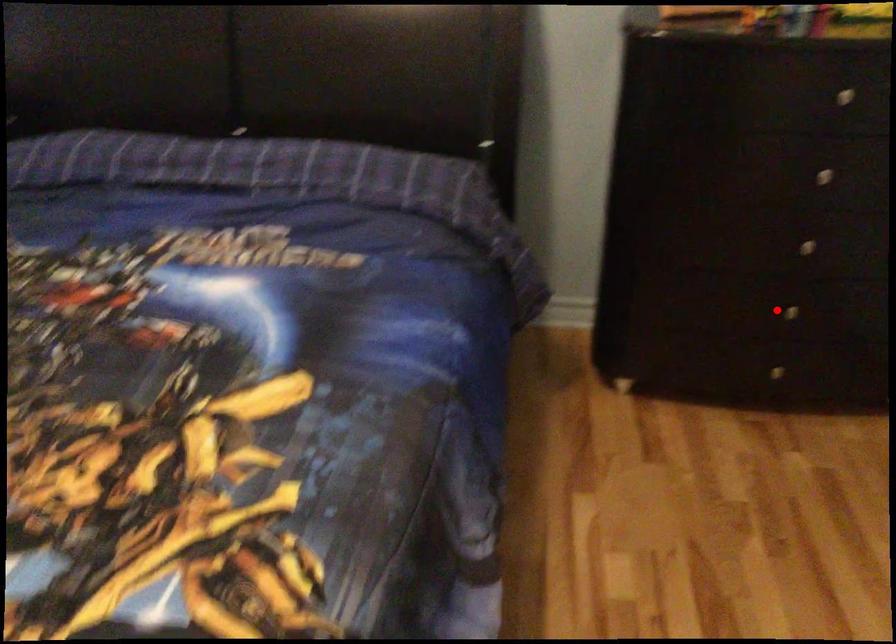
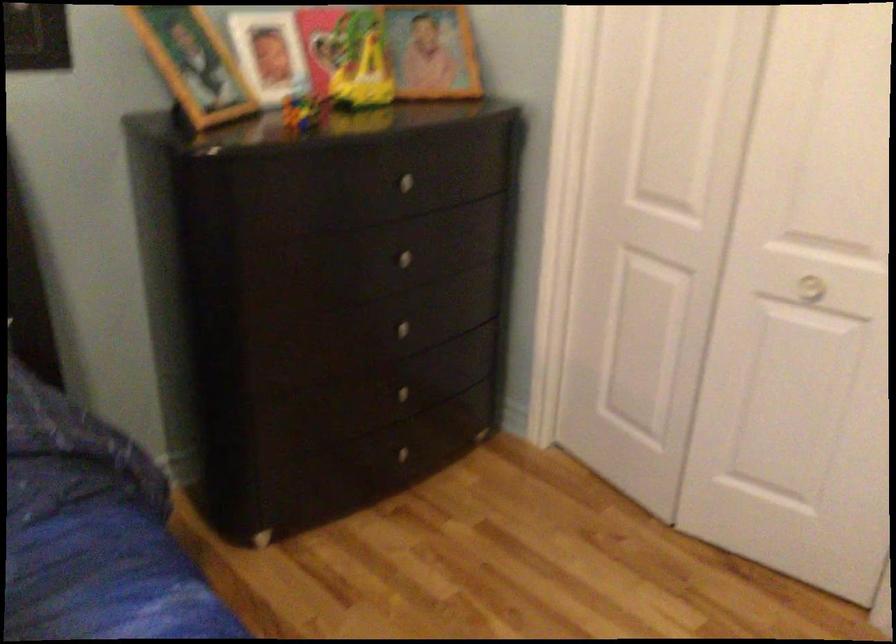
Find the pixel in the second image that matches the highlighted location in the first image.

(400, 393)